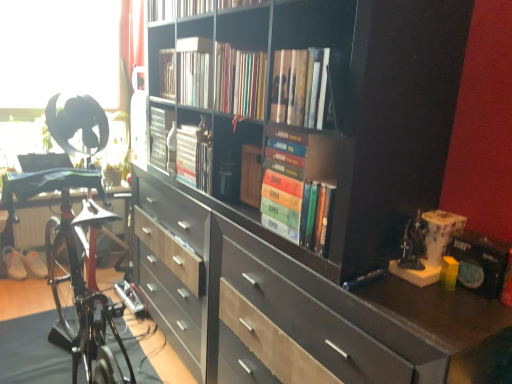
Question: Is matte black bookcase at center directly adjacent to satin silver book at center, which is the second book from back to front?

Choices:
 (A) no
 (B) yes

Answer: (A)

Question: From a real-world perspective, is matte black bookcase at center on top of satin silver book at center, the 4th book when ordered from front to back?

Choices:
 (A) no
 (B) yes

Answer: (A)

Question: Is matte black bookcase at center positioned before satin silver book at center, which is the second book from back to front?

Choices:
 (A) no
 (B) yes

Answer: (B)

Question: Does matte black bookcase at center have a greater width compared to satin silver book at center, which is the second book from back to front?

Choices:
 (A) no
 (B) yes

Answer: (B)

Question: Does matte black bookcase at center have a greater height compared to satin silver book at center, which is the second book from back to front?

Choices:
 (A) no
 (B) yes

Answer: (B)

Question: Does matte black bookcase at center appear on the left side of satin silver book at center, which is the second book from back to front?

Choices:
 (A) no
 (B) yes

Answer: (A)

Question: Is matte black paperback book at right not within white fabric shoe at lower left, acting as the 1th footwear starting from the left?

Choices:
 (A) yes
 (B) no

Answer: (A)

Question: Is matte black paperback book at right thinner than white fabric shoe at lower left, arranged as the second footwear when viewed from the right?

Choices:
 (A) no
 (B) yes

Answer: (B)

Question: Considering the relative positions of matte black paperback book at right and white fabric shoe at lower left, arranged as the second footwear when viewed from the right, in the image provided, is matte black paperback book at right to the right of white fabric shoe at lower left, arranged as the second footwear when viewed from the right, from the viewer's perspective?

Choices:
 (A) yes
 (B) no

Answer: (A)

Question: Could you tell me if matte black paperback book at right is facing white fabric shoe at lower left, arranged as the second footwear when viewed from the right?

Choices:
 (A) no
 (B) yes

Answer: (A)

Question: From a real-world perspective, is matte black paperback book at right positioned under white fabric shoe at lower left, acting as the 1th footwear starting from the left, based on gravity?

Choices:
 (A) no
 (B) yes

Answer: (A)

Question: Is matte black paperback book at right looking in the opposite direction of white fabric shoe at lower left, acting as the 1th footwear starting from the left?

Choices:
 (A) no
 (B) yes

Answer: (A)

Question: Does white fabric shoe at lower left, arranged as the second footwear when viewed from the right, have a lesser height compared to hardcover books at center, the fourth book viewed from the back?

Choices:
 (A) yes
 (B) no

Answer: (A)